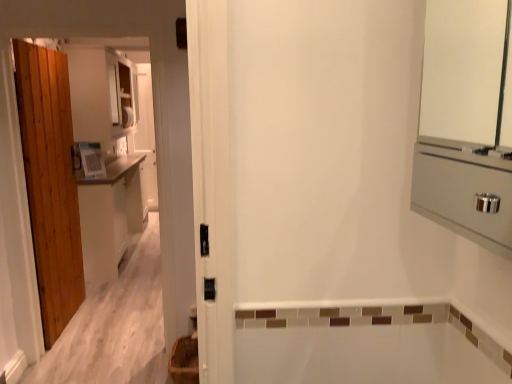
Question: Is point (189, 344) closer or farther from the camera than point (143, 185)?

Choices:
 (A) closer
 (B) farther

Answer: (A)

Question: Is brown woven basket at lower left spatially inside white matte cabinet at left, or outside of it?

Choices:
 (A) inside
 (B) outside

Answer: (B)

Question: Is brown woven basket at lower left wider or thinner than white matte cabinet at left?

Choices:
 (A) wide
 (B) thin

Answer: (A)

Question: Is white matte cabinet at left taller or shorter than brown woven basket at lower left?

Choices:
 (A) tall
 (B) short

Answer: (A)

Question: Does point (120, 249) appear closer or farther from the camera than point (187, 365)?

Choices:
 (A) farther
 (B) closer

Answer: (A)

Question: In terms of size, does white matte cabinet at left appear bigger or smaller than brown woven basket at lower left?

Choices:
 (A) big
 (B) small

Answer: (A)

Question: In terms of width, does white matte cabinet at left look wider or thinner when compared to brown woven basket at lower left?

Choices:
 (A) thin
 (B) wide

Answer: (A)